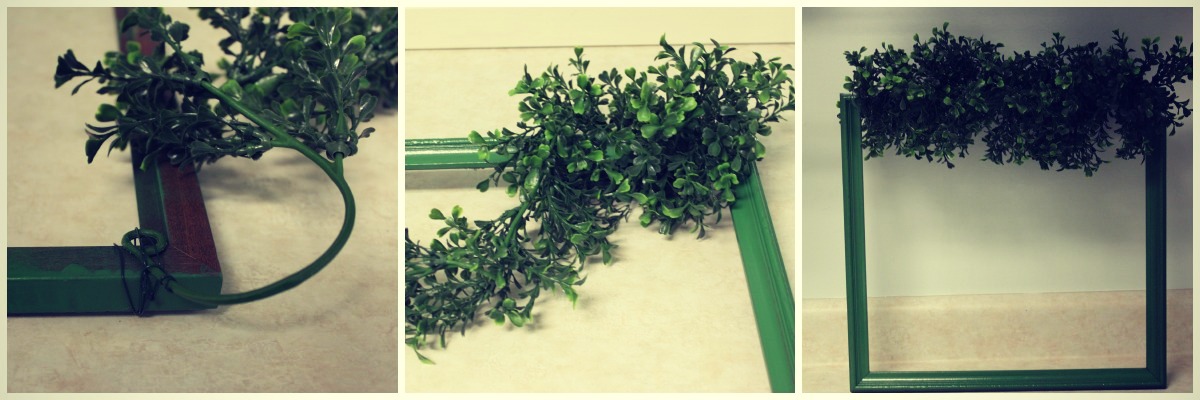
Where is `1 frame on the right`? Image resolution: width=1200 pixels, height=400 pixels. 1 frame on the right is located at coordinates (1151, 362).